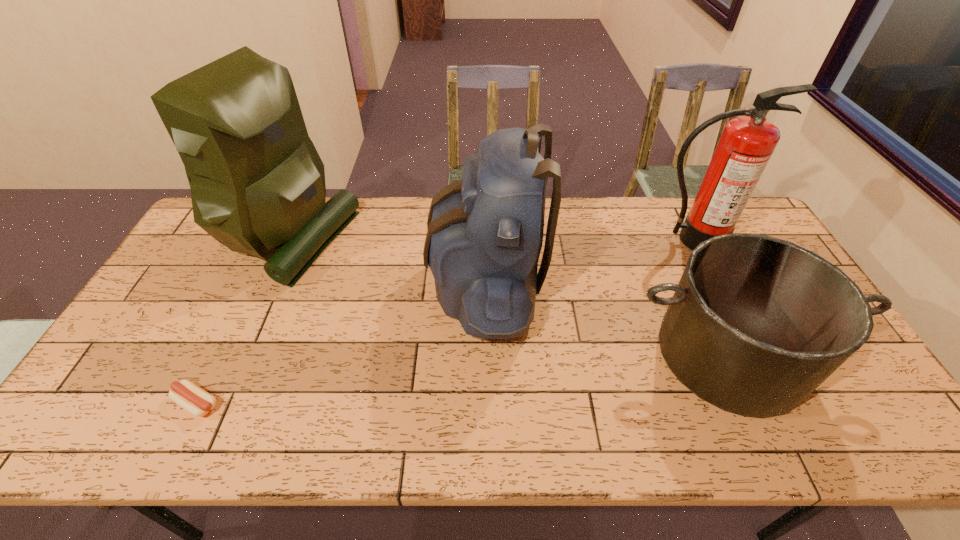
I want to click on object located in the near right corner section of the desktop, so click(756, 324).

I want to click on blank space at the far edge, so click(x=423, y=214).

Where is `free space at the near edge`? The width and height of the screenshot is (960, 540). free space at the near edge is located at coordinates (327, 434).

This screenshot has height=540, width=960. Identify the location of vacant region at the left edge. (204, 296).

Identify the location of vacant space in between the left backpack and the sausage. This screenshot has width=960, height=540. (241, 320).

You are a GUI agent. You are given a task and a screenshot of the screen. Output one action in this format:
    pyautogui.click(x=<x>, y=<y>)
    Task: Click on the empty space between the right backpack and the pan
    
    Given the screenshot: What is the action you would take?
    pyautogui.click(x=607, y=319)

Where is `vacant space that is in between the fire extinguisher and the sausage`? vacant space that is in between the fire extinguisher and the sausage is located at coordinates (444, 322).

This screenshot has width=960, height=540. Find the location of `empty location between the fire extinguisher and the third object from right to left`. empty location between the fire extinguisher and the third object from right to left is located at coordinates (588, 261).

Locate which object ranks in proximity to the fourth tallest object. Please provide its 2D coordinates. Your answer should be formatted as a tuple, i.e. [(x, y)], where the tuple contains the x and y coordinates of a point satisfying the conditions above.

[(746, 145)]

This screenshot has width=960, height=540. I want to click on object that is the second nearest to the fire extinguisher, so click(485, 232).